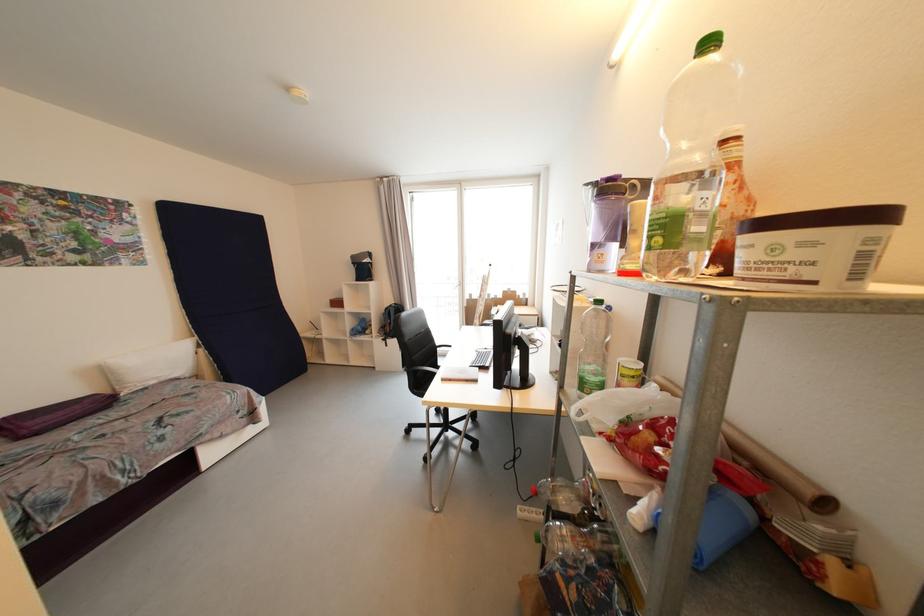
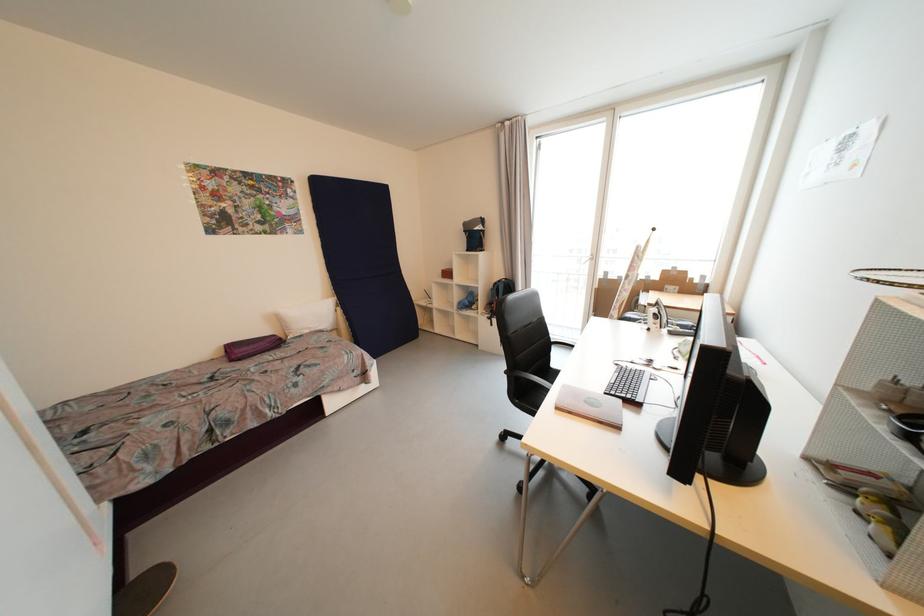
Question: Which direction would the cameraman need to move to produce the second image? Reply with the corresponding letter.

Choices:
 (A) Left
 (B) Right
 (C) Forward
 (D) Backward

Answer: (C)